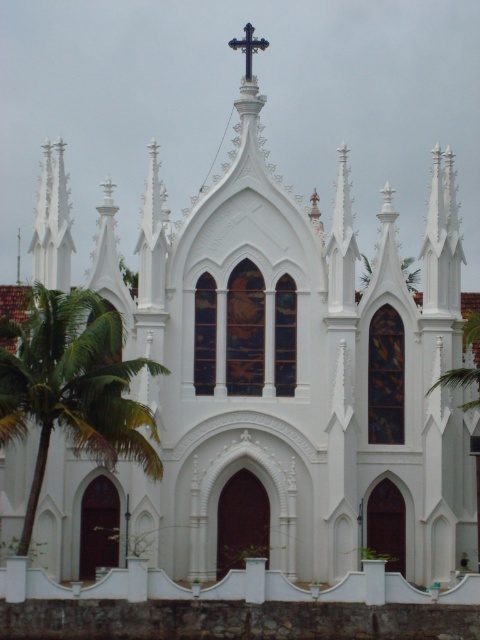
Find the location of a particular element. The image size is (480, 640). green leafy palm tree at left is located at coordinates (72, 385).

Does green leafy palm tree at left appear on the left side of black metal cross at upper center?

Yes, green leafy palm tree at left is to the left of black metal cross at upper center.

Does point (108, 330) lie in front of point (253, 48)?

Yes, it is in front of point (253, 48).

At what (x,y) coordinates should I click in order to perform the action: click on green leafy palm tree at left. Please return your answer as a coordinate pair (x, y). The height and width of the screenshot is (640, 480). Looking at the image, I should click on (72, 385).

Measure the distance between green leafy palm tree at left and camera.

green leafy palm tree at left is 314.16 feet from camera.

Measure the distance between green leafy palm tree at left and camera.

green leafy palm tree at left and camera are 95.76 meters apart from each other.

This screenshot has width=480, height=640. Find the location of `green leafy palm tree at left`. green leafy palm tree at left is located at coordinates (72, 385).

Is green leafy palm tree at right to the right of black metal cross at upper center from the viewer's perspective?

Yes, green leafy palm tree at right is to the right of black metal cross at upper center.

What do you see at coordinates (466, 365) in the screenshot? I see `green leafy palm tree at right` at bounding box center [466, 365].

Locate an element on the screen. green leafy palm tree at right is located at coordinates (466, 365).